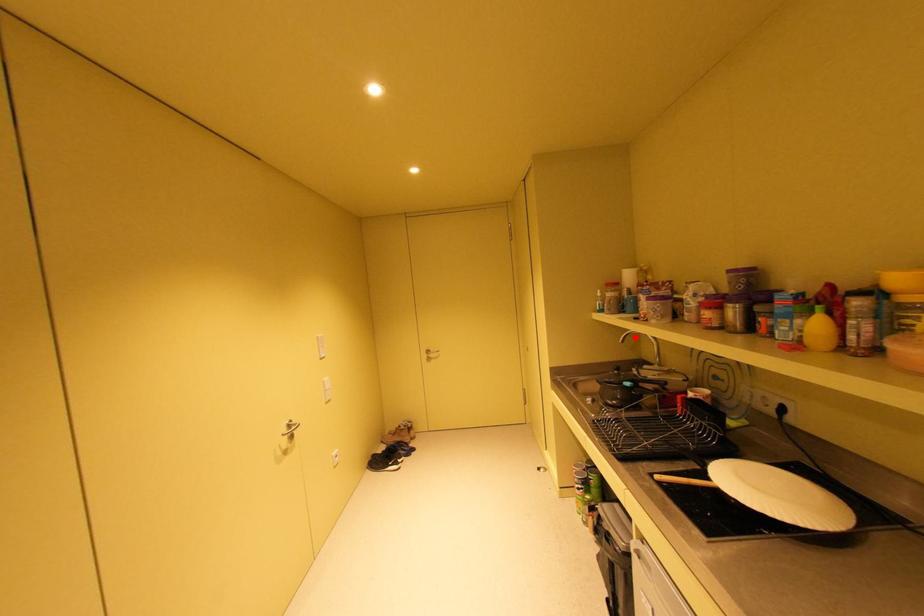
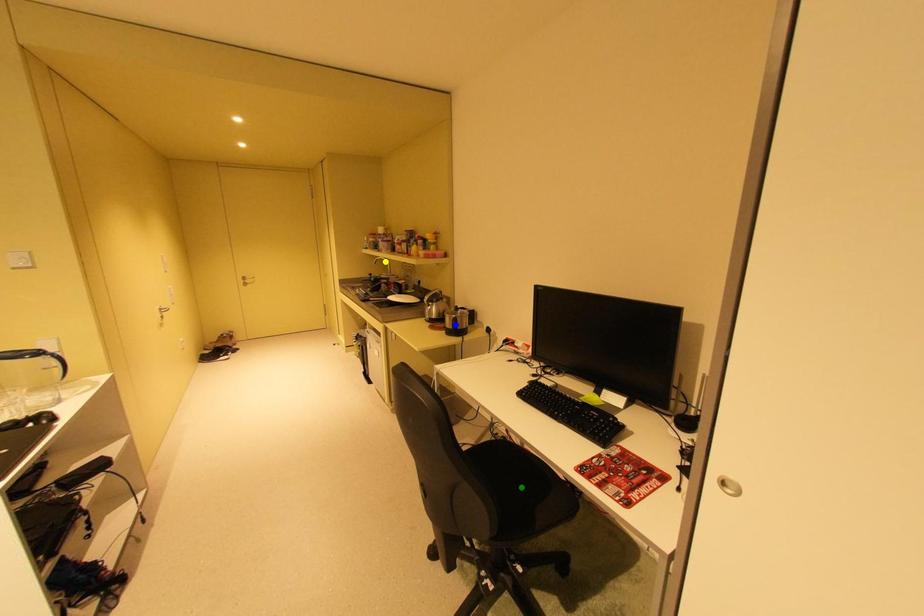
Question: I am providing you with two images of the same scene from different viewpoints. A red point is marked on the first image. You are given multiple points on the second image. Which spot in image 2 lines up with the point in image 1?

Choices:
 (A) yellow point
 (B) blue point
 (C) green point

Answer: (A)